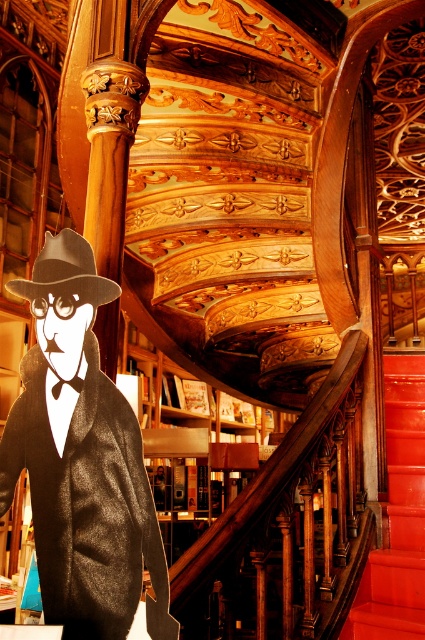
Question: Which point is farther to the camera?

Choices:
 (A) shiny red stair at center
 (B) matte black coat at center
 (C) matte brown fedora at center

Answer: (A)

Question: Which object appears closest to the camera in this image?

Choices:
 (A) shiny red stair at center
 (B) matte black coat at center
 (C) matte brown fedora at center

Answer: (B)

Question: Among these points, which one is nearest to the camera?

Choices:
 (A) (54, 288)
 (B) (422, 417)

Answer: (A)

Question: Does shiny red stair at center appear over matte brown fedora at center?

Choices:
 (A) yes
 (B) no

Answer: (B)

Question: Does matte black coat at center come behind matte brown fedora at center?

Choices:
 (A) no
 (B) yes

Answer: (A)

Question: Does matte black coat at center appear under shiny red stair at center?

Choices:
 (A) no
 (B) yes

Answer: (A)